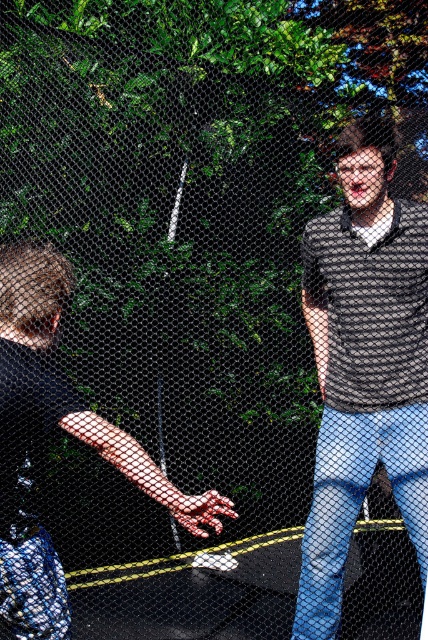
Who is shorter, matte black shirt at right or black matte shirt at left?

black matte shirt at left is shorter.

Is point (341, 566) behind point (74, 403)?

Yes.

The height and width of the screenshot is (640, 428). Describe the element at coordinates (363, 364) in the screenshot. I see `matte black shirt at right` at that location.

You are a GUI agent. You are given a task and a screenshot of the screen. Output one action in this format:
    pyautogui.click(x=<x>, y=<y>)
    Task: Click on the matte black shirt at right
    
    Given the screenshot: What is the action you would take?
    pyautogui.click(x=363, y=364)